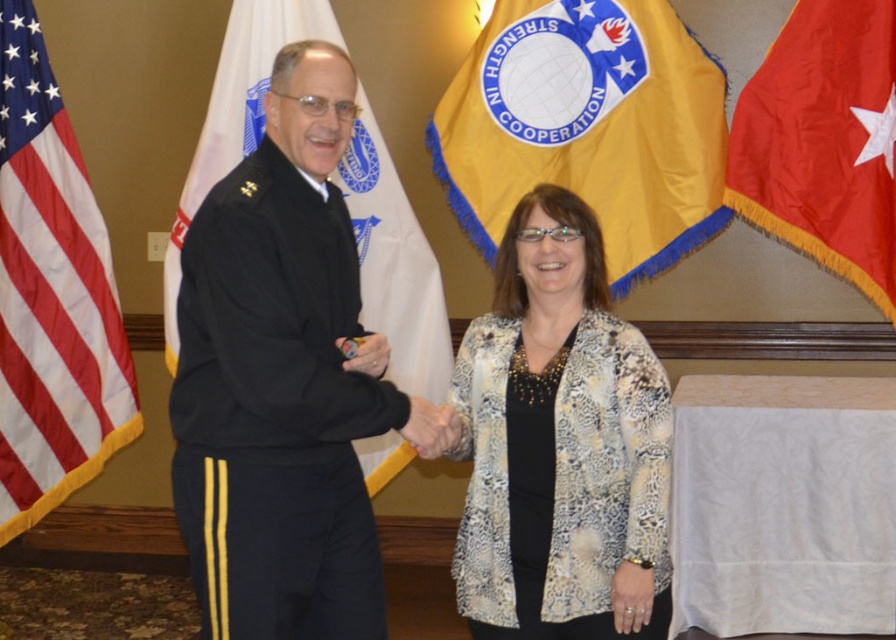
Question: Among these objects, which one is farthest from the camera?

Choices:
 (A) black fabric flag at left
 (B) red fabric flag at right
 (C) black fabric uniform at center

Answer: (B)

Question: Which point is closer to the camera?

Choices:
 (A) black fabric flag at left
 (B) black fabric uniform at center
 (C) printed fabric jacket at center

Answer: (B)

Question: Considering the relative positions of yellow fabric flag at center and black fabric flag at left in the image provided, where is yellow fabric flag at center located with respect to black fabric flag at left?

Choices:
 (A) left
 (B) right

Answer: (B)

Question: Does black fabric uniform at center have a larger size compared to printed fabric jacket at center?

Choices:
 (A) yes
 (B) no

Answer: (A)

Question: Where is black fabric uniform at center located in relation to black fabric flag at left in the image?

Choices:
 (A) above
 (B) below

Answer: (B)

Question: Which object is the closest to the printed fabric jacket at center?

Choices:
 (A) black fabric flag at left
 (B) red-white striped fabric at left
 (C) red fabric flag at right
 (D) yellow fabric flag at center

Answer: (A)